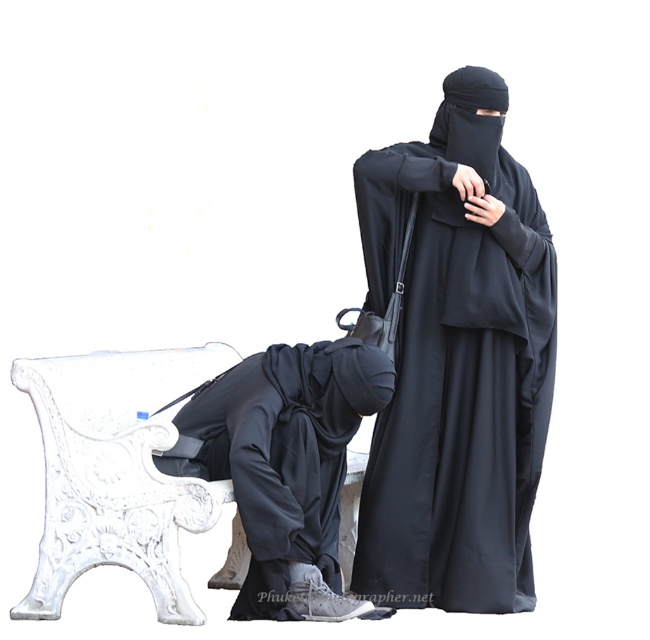
Question: Which object is farther from the camera taking this photo?

Choices:
 (A) black matte niqab at center
 (B) matte black clothing at lower left

Answer: (A)

Question: Among these points, which one is farthest from the camera?

Choices:
 (A) (330, 512)
 (B) (474, 124)

Answer: (B)

Question: Is black matte niqab at center below matte black clothing at lower left?

Choices:
 (A) yes
 (B) no

Answer: (B)

Question: Does black matte niqab at center appear on the left side of matte black clothing at lower left?

Choices:
 (A) no
 (B) yes

Answer: (A)

Question: Does black matte niqab at center have a larger size compared to matte black clothing at lower left?

Choices:
 (A) yes
 (B) no

Answer: (A)